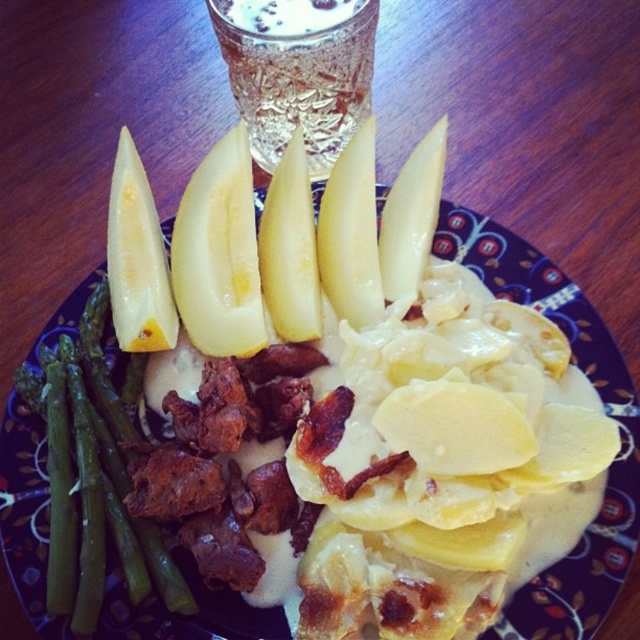
You are a food critic evaluating the arrangement of this plated meal. You notice two specific points on the plate marked as point 1 at coordinates (216,17) and point 2 at coordinates (88,339). Which point is closer to you when observing the plate?

Point 1 at coordinates (216,17) is closer to you than point 2 at coordinates (88,339) because it is further to the viewer.

You are a chef preparing a meal and need to place a new garnish between the yellow matte potato at center and the yellow smooth apple at upper left. The garnish requires a minimum of 7 inches of space. Based on the image, will there be enough space for it?

The yellow matte potato at center and yellow smooth apple at upper left are 6.72 inches apart from each other, so there is not enough space to place the garnish requiring 7 inches of space between them.

You are a food critic analyzing the arrangement of this meal. From your perspective, which of the two points, point (624, 497) or point (109, 284), is closer to you?

Point (624, 497) is in front of point (109, 284), so it is closer to you.